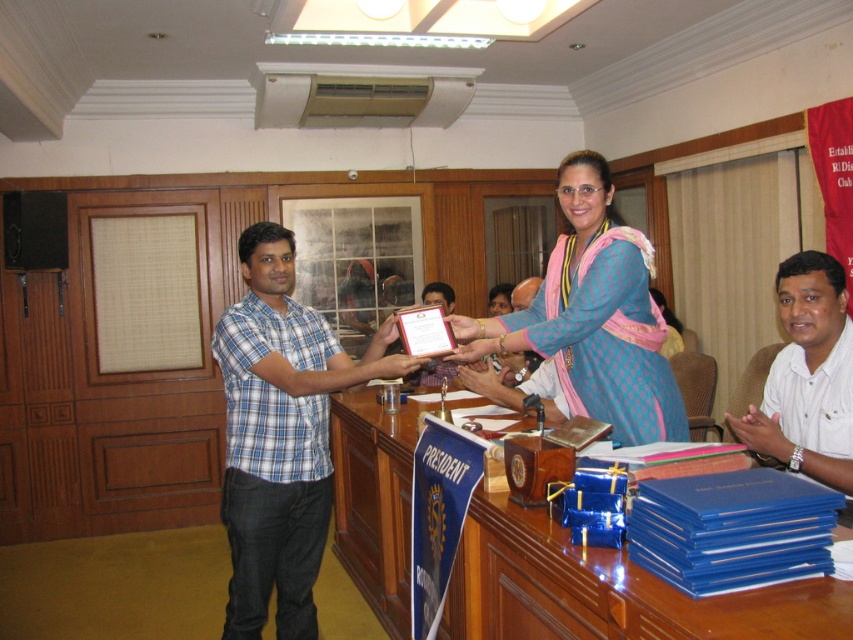
Who is more forward, (550, 556) or (248, 419)?

Point (550, 556)

Measure the distance between shiny wooden table at center and camera.

shiny wooden table at center is 8.92 feet from camera.

Locate an element on the screen. shiny wooden table at center is located at coordinates coord(606,589).

Is blue silk saree at center taller than white matte shirt at lower right?

Correct, blue silk saree at center is much taller as white matte shirt at lower right.

Does blue silk saree at center appear under white matte shirt at lower right?

No, blue silk saree at center is not below white matte shirt at lower right.

Describe the element at coordinates (593, 316) in the screenshot. The image size is (853, 640). I see `blue silk saree at center` at that location.

The height and width of the screenshot is (640, 853). I want to click on blue silk saree at center, so click(x=593, y=316).

Can you confirm if shiny wooden table at center is taller than white matte shirt at lower right?

Yes, shiny wooden table at center is taller than white matte shirt at lower right.

This screenshot has height=640, width=853. I want to click on shiny wooden table at center, so click(606, 589).